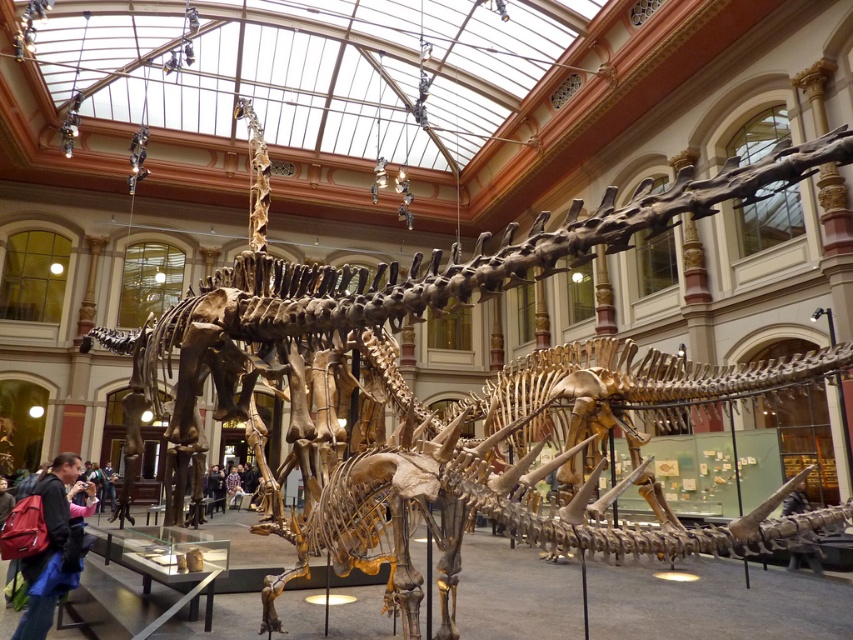
You are a security guard in the museum and need to determine if the dark blue jacket at center and plaid shirt at center are overlapping in the image. Based on their heights, can you tell which one might be in front of the other?

The dark blue jacket at center is taller than plaid shirt at center, so it is likely in front of the plaid shirt at center.

In the scene shown: You are a visitor in the museum and want to touch the smooth wooden stick at lower right. Can you reach it from your current position at point (804, 556)?

Yes, you are already at the point where the smooth wooden stick at lower right is located.